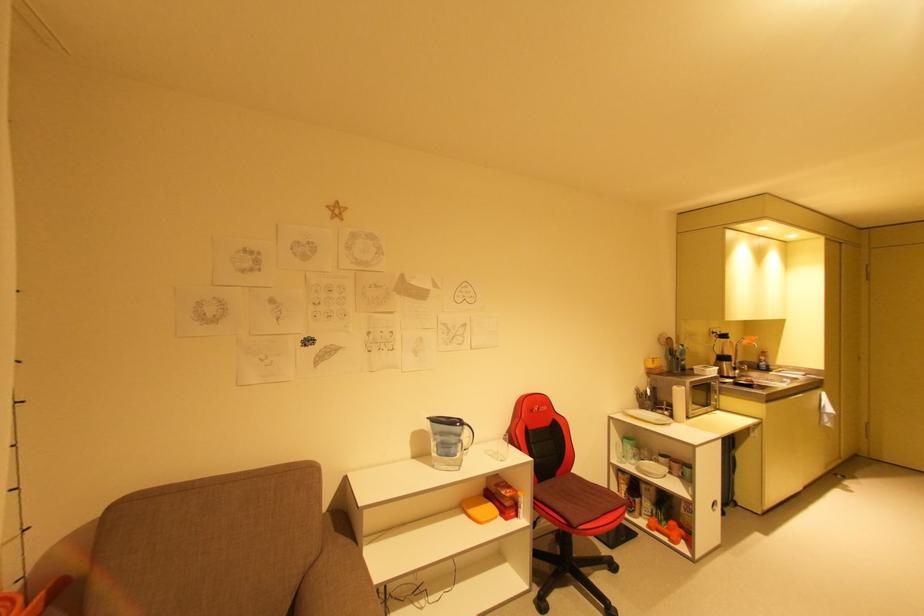
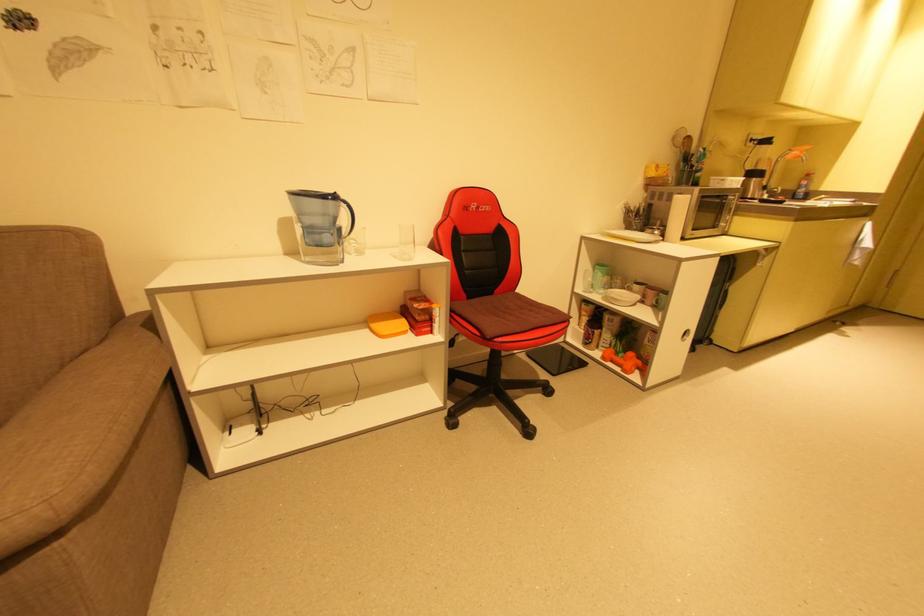
What movement of the cameraman would produce the second image?

The cameraman walked toward right, forward.